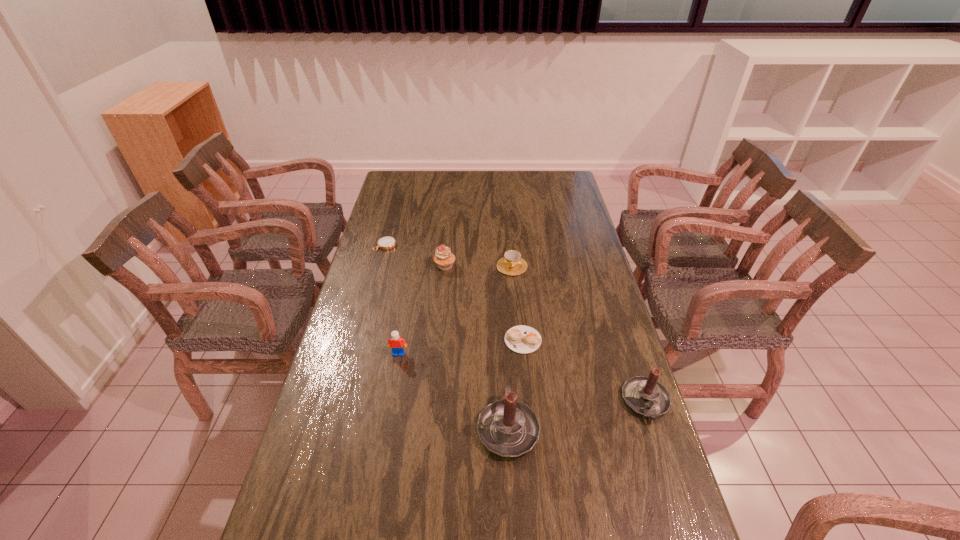
Where is `object positioned at the right edge`? object positioned at the right edge is located at coordinates (644, 395).

Where is `free region at the far edge`? This screenshot has width=960, height=540. free region at the far edge is located at coordinates (469, 171).

Image resolution: width=960 pixels, height=540 pixels. In the image, there is a desktop. In order to click on vacant space at the near edge in this screenshot , I will do `click(606, 515)`.

In order to click on free space at the left edge of the desktop in this screenshot , I will do `click(363, 258)`.

Identify the location of free space at the right edge of the desktop. This screenshot has height=540, width=960. (636, 423).

Identify the location of vacant area that lies between the cappuccino and the taller candle. (516, 383).

The height and width of the screenshot is (540, 960). I want to click on vacant space that's between the shorter candle and the cappuccino, so click(585, 371).

You are a GUI agent. You are given a task and a screenshot of the screen. Output one action in this format:
    pyautogui.click(x=<x>, y=<y>)
    Task: Click on the vacant space in between the farthest object and the shorter candle
    Image resolution: width=960 pixels, height=540 pixels.
    Given the screenshot: What is the action you would take?
    click(x=516, y=323)

The image size is (960, 540). I want to click on free spot between the shorter candle and the cupcake, so click(x=545, y=334).

Where is `free spot between the sixth object from right to left and the cappuccino`? The height and width of the screenshot is (540, 960). free spot between the sixth object from right to left and the cappuccino is located at coordinates (461, 347).